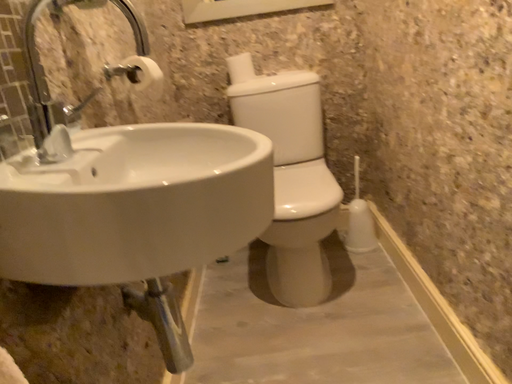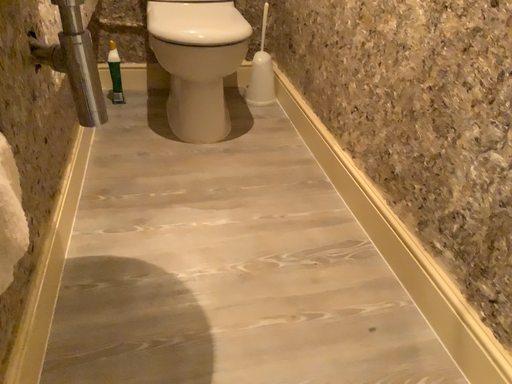
Question: How did the camera likely rotate when shooting the video?

Choices:
 (A) rotated downward
 (B) rotated upward

Answer: (A)